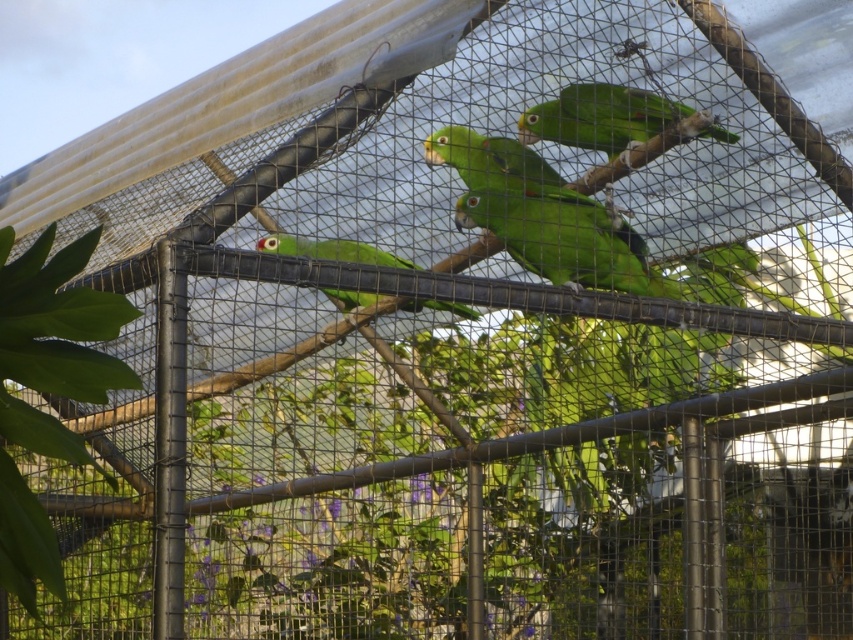
Question: Observing the image, what is the correct spatial positioning of green matte parrot at upper center in reference to green matte parrot at center?

Choices:
 (A) left
 (B) right

Answer: (B)

Question: Which object is closer to the camera taking this photo?

Choices:
 (A) green matte parrot at upper center
 (B) green matte parrot at center

Answer: (B)

Question: Among these objects, which one is nearest to the camera?

Choices:
 (A) green matte parrot at center
 (B) green matte parrot at upper center

Answer: (A)

Question: Is green matte parrot at upper center wider than green matte parrot at center?

Choices:
 (A) yes
 (B) no

Answer: (B)

Question: Is green matte parrot at upper center further to the viewer compared to green matte parrot at center?

Choices:
 (A) yes
 (B) no

Answer: (A)

Question: Which point is farther to the camera?

Choices:
 (A) (350, 291)
 (B) (723, 134)

Answer: (B)